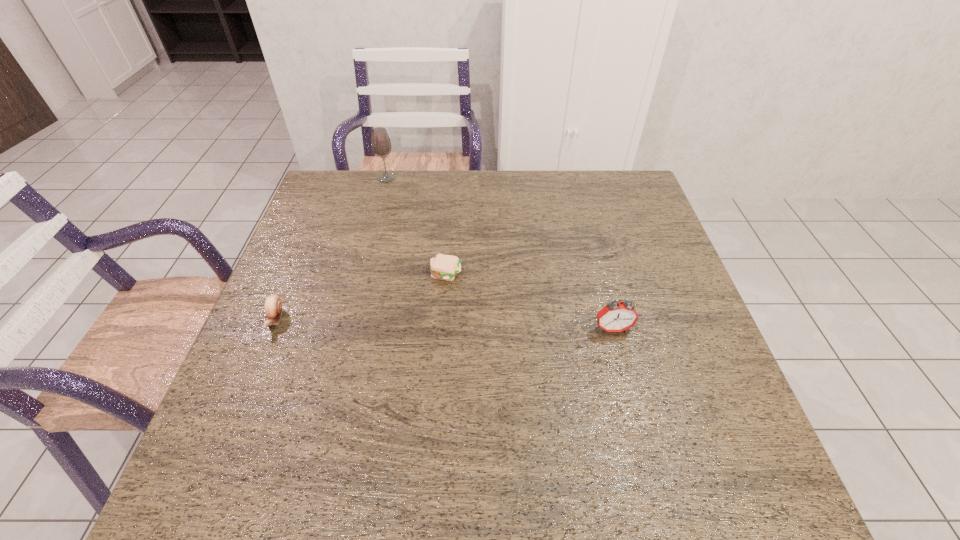
Where is `the third object from right to left`? This screenshot has height=540, width=960. the third object from right to left is located at coordinates (381, 145).

Find the location of a particular element. Image resolution: width=960 pixels, height=540 pixels. glass drink container is located at coordinates (381, 145).

Find the location of a particular element. This screenshot has height=540, width=960. the third shortest object is located at coordinates (616, 316).

This screenshot has height=540, width=960. Find the location of `the rightmost object`. the rightmost object is located at coordinates (616, 316).

You are a GUI agent. You are given a task and a screenshot of the screen. Output one action in this format:
    pyautogui.click(x=<x>, y=<y>)
    Task: Click on the escargot
    The image size is (960, 540).
    Given the screenshot: What is the action you would take?
    pyautogui.click(x=273, y=306)

Locate an element on the screen. The width and height of the screenshot is (960, 540). the leftmost object is located at coordinates coord(273,306).

You are a GUI agent. You are given a task and a screenshot of the screen. Output one action in this format:
    pyautogui.click(x=<x>, y=<y>)
    Task: Click on the third nearest object
    The width and height of the screenshot is (960, 540).
    Given the screenshot: What is the action you would take?
    pyautogui.click(x=443, y=267)

Where is `patty`? This screenshot has height=540, width=960. patty is located at coordinates (443, 267).

This screenshot has height=540, width=960. What are the coordinates of `vacant space positioned on the front of the tallest object` in the screenshot? It's located at (381, 200).

Where is `vacant space located on the clock face of the alarm clock`? The height and width of the screenshot is (540, 960). vacant space located on the clock face of the alarm clock is located at coordinates (647, 462).